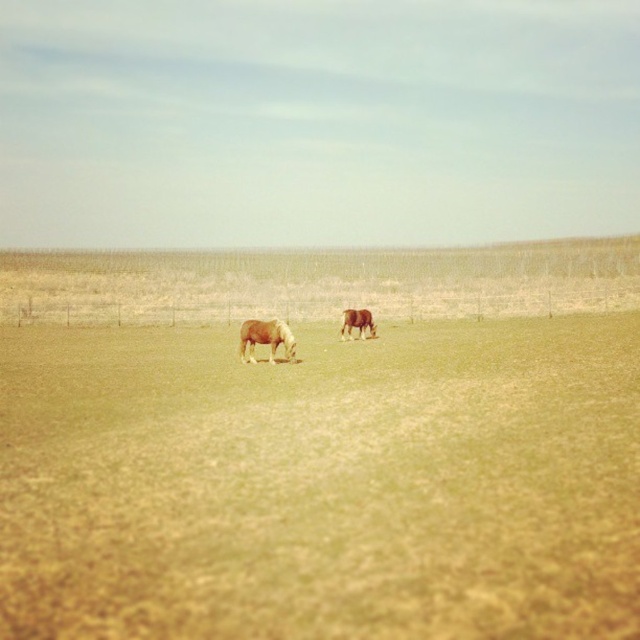
Question: Which object is farther from the camera taking this photo?

Choices:
 (A) green grassy field at center
 (B) light brown horse at center
 (C) brown matte horse at center

Answer: (C)

Question: Does green grassy field at center have a smaller size compared to brown matte horse at center?

Choices:
 (A) yes
 (B) no

Answer: (B)

Question: Is green grassy field at center to the left of light brown horse at center from the viewer's perspective?

Choices:
 (A) yes
 (B) no

Answer: (A)

Question: Which point is farther from the camera taking this photo?

Choices:
 (A) (358, 330)
 (B) (284, 339)
 (C) (550, 596)

Answer: (A)

Question: Is green grassy field at center further to camera compared to brown matte horse at center?

Choices:
 (A) no
 (B) yes

Answer: (A)

Question: Which of the following is the closest to the observer?

Choices:
 (A) light brown horse at center
 (B) green grassy field at center

Answer: (B)